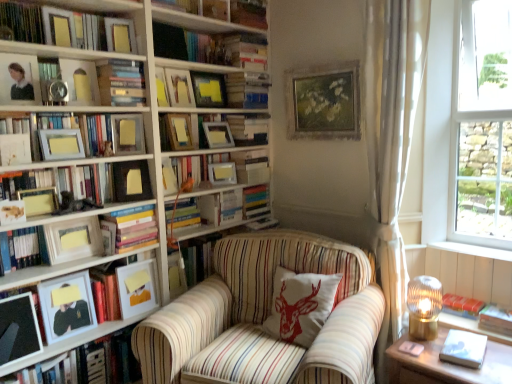
You are a GUI agent. You are given a task and a screenshot of the screen. Output one action in this format:
    pyautogui.click(x=<x>, y=<y>)
    Task: Click on the free space in front of white paper book at lower right, which is the second book in bottom-to-top order
    The height and width of the screenshot is (384, 512).
    Given the screenshot: What is the action you would take?
    pyautogui.click(x=477, y=372)